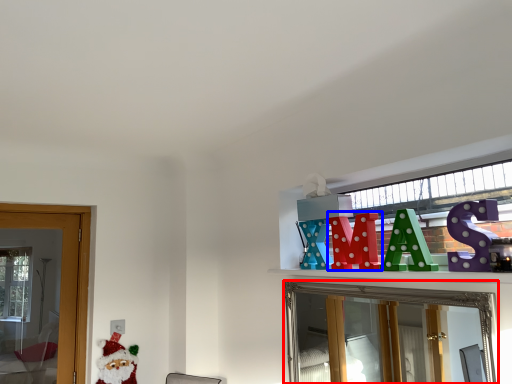
Question: Among these objects, which one is farthest to the camera, mirror (highlighted by a red box) or toy (highlighted by a blue box)?

Choices:
 (A) mirror
 (B) toy

Answer: (B)